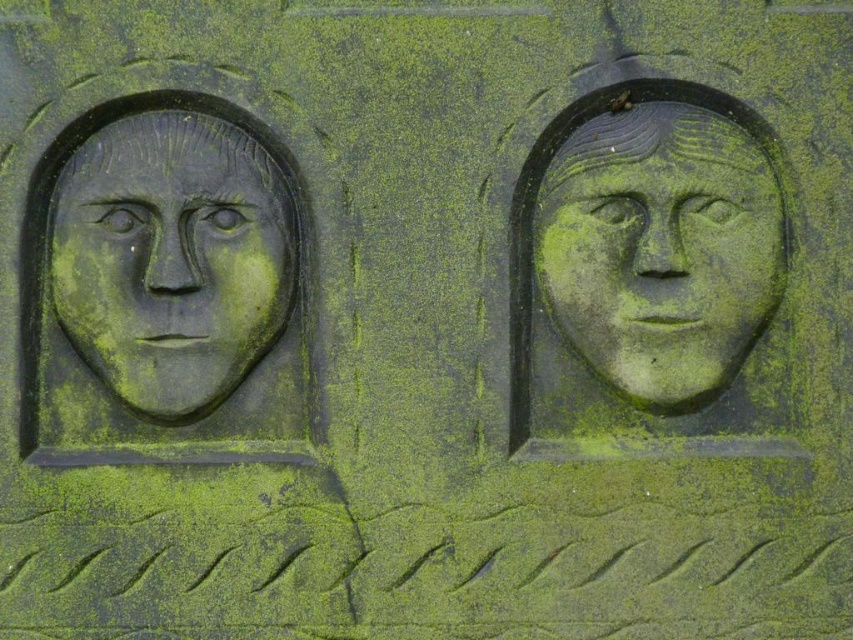
You are an archaeologist examining the stone relief. You notice a specific point at coordinates (660, 250). Based on the description, which object on the relief does this point correspond to?

The point at (660, 250) corresponds to the matte stone face at upper right.

You are an archaeologist examining the stone relief. You notice two points marked on the image at coordinates point [602,204] and point [115,326]. Which point is closer to your eyes?

Point [602,204] is further to the camera than point [115,326], so the point closer to your eyes is point [115,326].